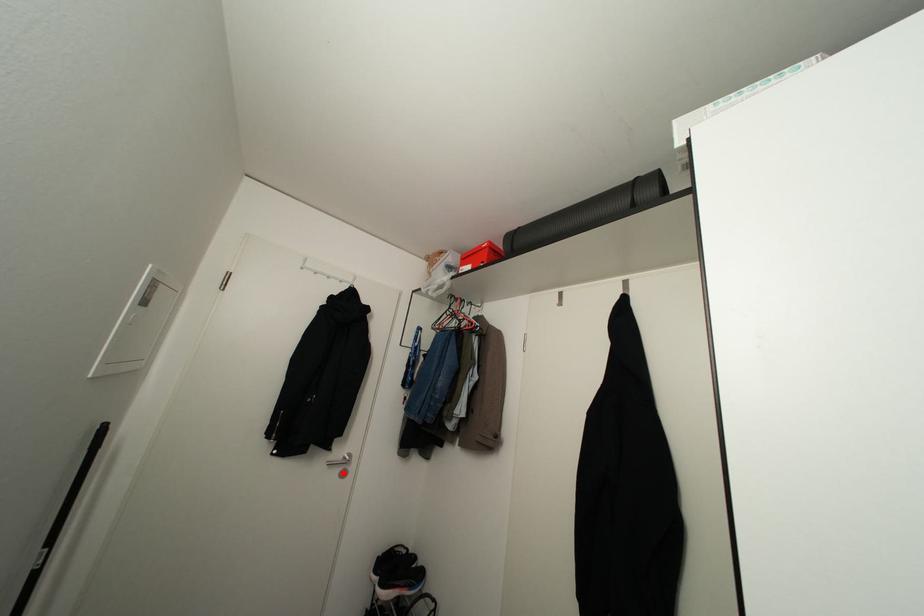
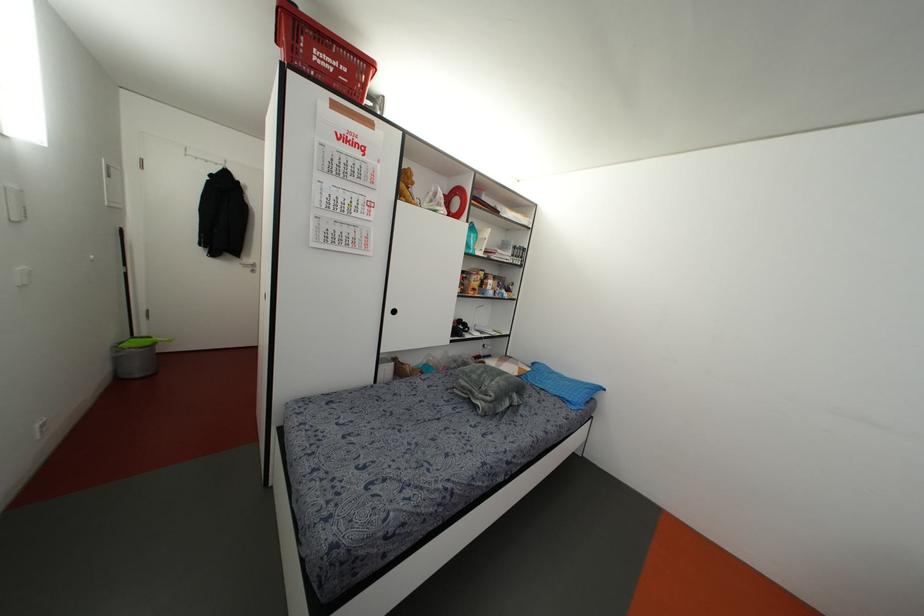
Where in the second image is the point corresponding to the highlighted location from the first image?

(252, 270)